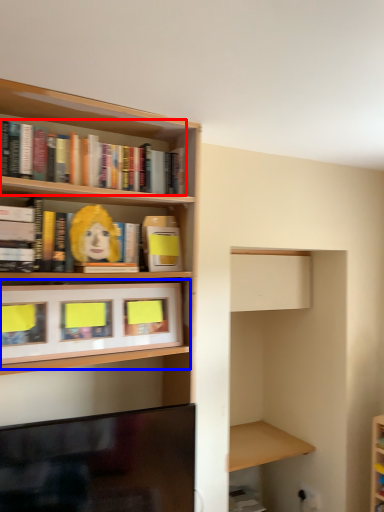
Question: Which of the following is the closest to the observer, book (highlighted by a red box) or cabinet (highlighted by a blue box)?

Choices:
 (A) book
 (B) cabinet

Answer: (B)